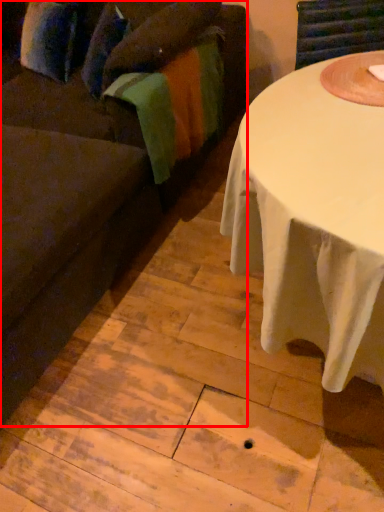
Question: From the image's perspective, what is the correct spatial positioning of studio couch (annotated by the red box) in reference to blanket?

Choices:
 (A) above
 (B) below

Answer: (B)